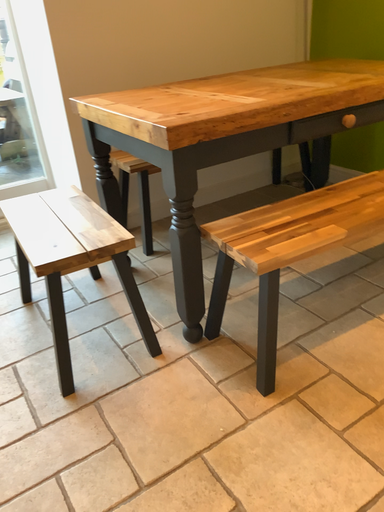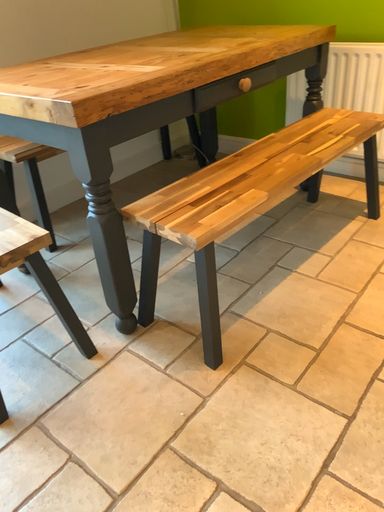
Question: Which way did the camera rotate in the video?

Choices:
 (A) rotated left
 (B) rotated right

Answer: (B)